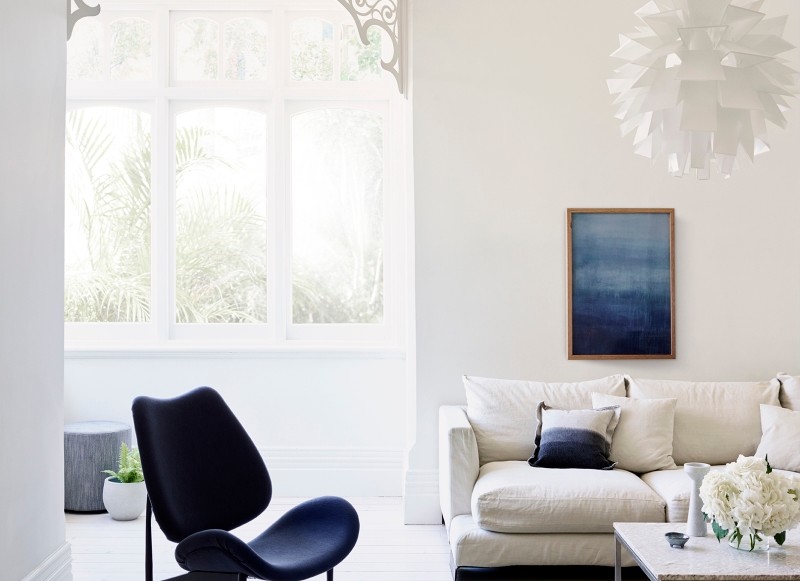
Where is `pillow`? This screenshot has height=581, width=800. pillow is located at coordinates click(x=586, y=446).